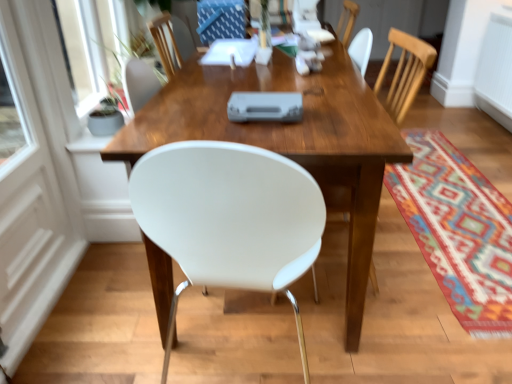
Question: Considering the positions of white glossy door at left and wooden table at center in the image, is white glossy door at left wider or thinner than wooden table at center?

Choices:
 (A) thin
 (B) wide

Answer: (A)

Question: Is white glossy door at left in front of or behind wooden table at center in the image?

Choices:
 (A) front
 (B) behind

Answer: (A)

Question: Estimate the real-world distances between objects in this image. Which object is closer to the multicolored woven mat at lower right?

Choices:
 (A) white glossy door at left
 (B) wooden table at center

Answer: (B)

Question: Which of these objects is positioned farthest from the white glossy door at left?

Choices:
 (A) wooden table at center
 (B) multicolored woven mat at lower right

Answer: (B)